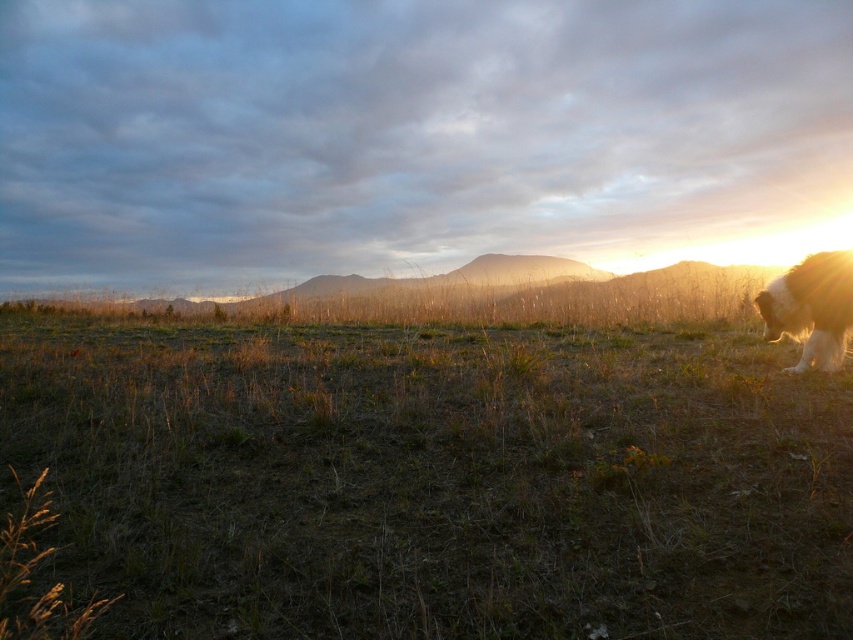
How much distance is there between brown dry grass at center and fuzzy white dog at right?

The distance of brown dry grass at center from fuzzy white dog at right is 5.81 feet.

Between brown dry grass at center and fuzzy white dog at right, which one appears on the left side from the viewer's perspective?

From the viewer's perspective, brown dry grass at center appears more on the left side.

Which is behind, point (775, 420) or point (798, 272)?

The point (798, 272) is more distant.

Find the location of a particular element. The image size is (853, 640). brown dry grass at center is located at coordinates (433, 477).